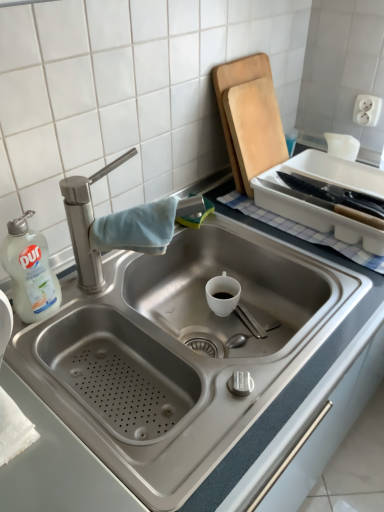
Question: Is white plastic bottle at left surrounded by wooden cutting board at upper right?

Choices:
 (A) no
 (B) yes

Answer: (A)

Question: Is wooden cutting board at upper right looking in the opposite direction of white plastic bottle at left?

Choices:
 (A) no
 (B) yes

Answer: (A)

Question: Does wooden cutting board at upper right lie in front of white plastic bottle at left?

Choices:
 (A) yes
 (B) no

Answer: (B)

Question: Does wooden cutting board at upper right have a lesser height compared to white plastic bottle at left?

Choices:
 (A) yes
 (B) no

Answer: (B)

Question: From a real-world perspective, does wooden cutting board at upper right stand above white plastic bottle at left?

Choices:
 (A) yes
 (B) no

Answer: (A)

Question: In terms of size, does stainless steel sink at center appear bigger or smaller than white plastic bottle at left?

Choices:
 (A) big
 (B) small

Answer: (A)

Question: Does point (16, 329) appear closer or farther from the camera than point (34, 278)?

Choices:
 (A) farther
 (B) closer

Answer: (A)

Question: From their relative heights in the image, would you say stainless steel sink at center is taller or shorter than white plastic bottle at left?

Choices:
 (A) tall
 (B) short

Answer: (A)

Question: Would you say stainless steel sink at center is to the left or to the right of white plastic bottle at left in the picture?

Choices:
 (A) right
 (B) left

Answer: (A)

Question: Considering the positions of white plastic bottle at left and stainless steel sink at center in the image, is white plastic bottle at left taller or shorter than stainless steel sink at center?

Choices:
 (A) tall
 (B) short

Answer: (B)

Question: Considering the positions of point (52, 285) and point (125, 304), is point (52, 285) closer or farther from the camera than point (125, 304)?

Choices:
 (A) closer
 (B) farther

Answer: (A)

Question: Would you say white plastic bottle at left is to the left or to the right of stainless steel sink at center in the picture?

Choices:
 (A) left
 (B) right

Answer: (A)

Question: Considering the positions of white plastic bottle at left and stainless steel sink at center in the image, is white plastic bottle at left wider or thinner than stainless steel sink at center?

Choices:
 (A) wide
 (B) thin

Answer: (B)

Question: Considering their positions, is white plastic tray at upper right located in front of or behind white plastic bottle at left?

Choices:
 (A) behind
 (B) front

Answer: (A)

Question: Considering the positions of white plastic tray at upper right and white plastic bottle at left in the image, is white plastic tray at upper right bigger or smaller than white plastic bottle at left?

Choices:
 (A) big
 (B) small

Answer: (A)